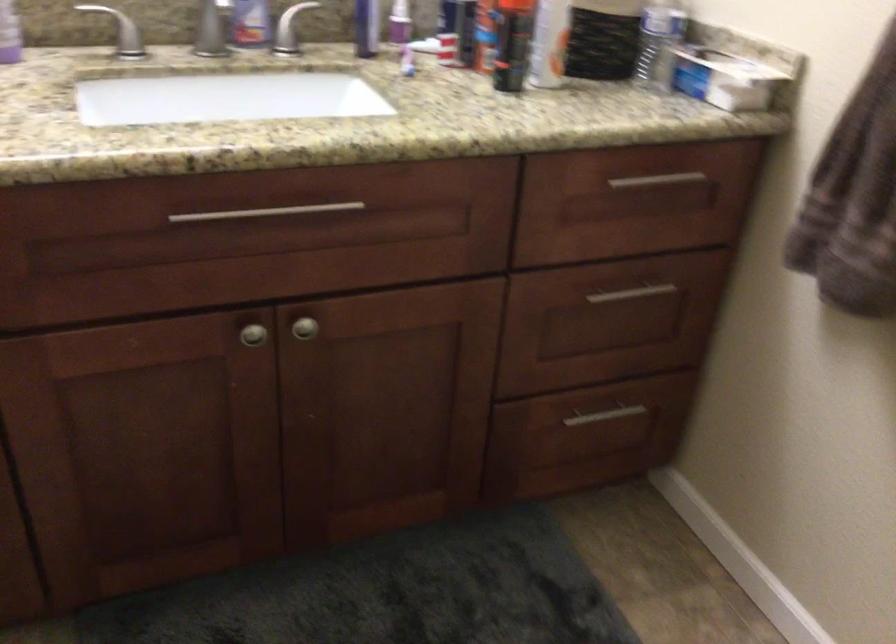
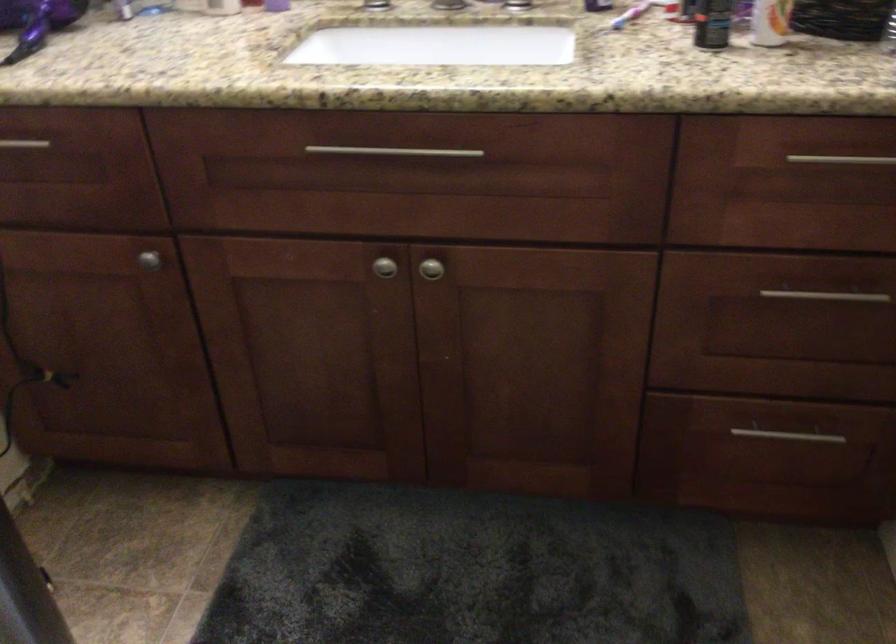
Find the pixel in the second image that matches pixel 591 428 in the first image.

(778, 446)